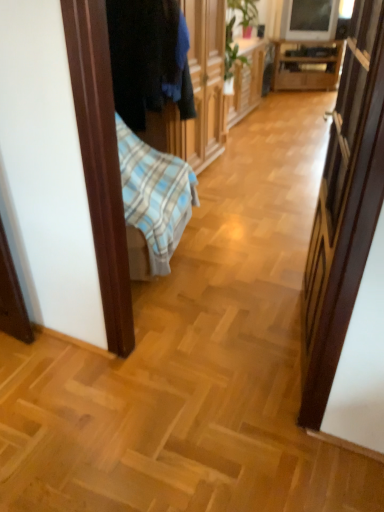
Question: Is dark blue fabric at left shorter than wooden cabinet at center?

Choices:
 (A) yes
 (B) no

Answer: (B)

Question: Can you confirm if dark blue fabric at left is wider than wooden cabinet at center?

Choices:
 (A) no
 (B) yes

Answer: (B)

Question: Does dark blue fabric at left touch wooden cabinet at center?

Choices:
 (A) no
 (B) yes

Answer: (A)

Question: Is dark blue fabric at left thinner than wooden cabinet at center?

Choices:
 (A) yes
 (B) no

Answer: (B)

Question: Does dark blue fabric at left have a greater height compared to wooden cabinet at center?

Choices:
 (A) no
 (B) yes

Answer: (B)

Question: Is dark blue fabric at left further to camera compared to wooden cabinet at center?

Choices:
 (A) yes
 (B) no

Answer: (B)

Question: From the image's perspective, is wooden cabinet at center below dark blue fabric at left?

Choices:
 (A) no
 (B) yes

Answer: (A)

Question: Is wooden cabinet at center touching dark blue fabric at left?

Choices:
 (A) no
 (B) yes

Answer: (A)

Question: Is wooden cabinet at center facing away from dark blue fabric at left?

Choices:
 (A) no
 (B) yes

Answer: (A)

Question: Considering the relative sizes of wooden cabinet at center and dark blue fabric at left in the image provided, is wooden cabinet at center smaller than dark blue fabric at left?

Choices:
 (A) yes
 (B) no

Answer: (B)

Question: From the image's perspective, does wooden cabinet at center appear higher than dark blue fabric at left?

Choices:
 (A) yes
 (B) no

Answer: (A)

Question: Does wooden cabinet at center appear on the left side of dark blue fabric at left?

Choices:
 (A) no
 (B) yes

Answer: (A)

Question: Is wooden cabinet at center placed right next to wooden cabinet at center?

Choices:
 (A) no
 (B) yes

Answer: (A)